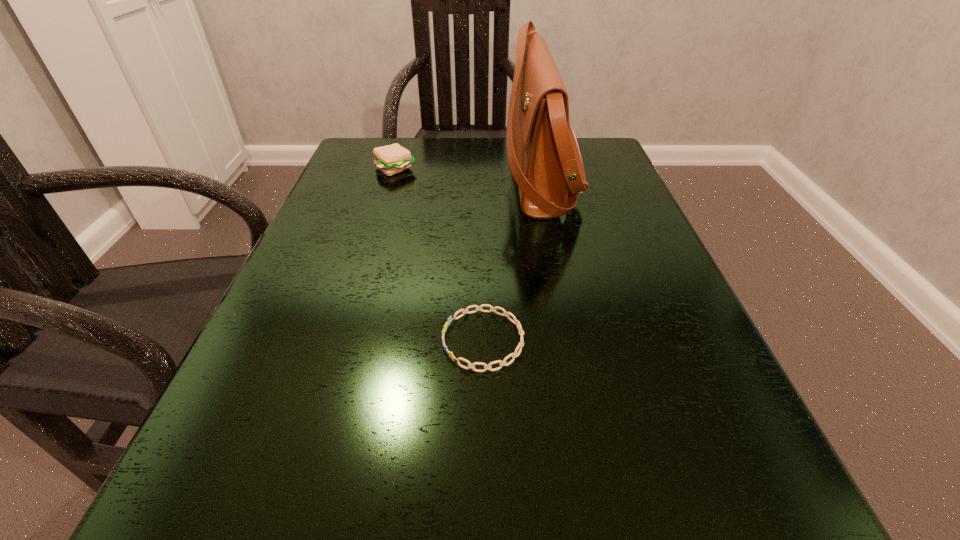
The image size is (960, 540). What are the coordinates of `satchel` in the screenshot? It's located at 544,157.

Identify the location of patty. The width and height of the screenshot is (960, 540). (390, 159).

Find the location of a particular element. Image resolution: width=960 pixels, height=540 pixels. the second tallest object is located at coordinates (390, 159).

Where is `the nearest object`? the nearest object is located at coordinates (502, 363).

Where is `the shortest object`? the shortest object is located at coordinates (502, 363).

The width and height of the screenshot is (960, 540). Find the location of `free region located on the front flap of the tallest object`. free region located on the front flap of the tallest object is located at coordinates (355, 177).

The image size is (960, 540). I want to click on vacant region located on the front flap of the tallest object, so click(399, 177).

Locate an element on the screen. Image resolution: width=960 pixels, height=540 pixels. vacant position located 0.330m on the front flap of the tallest object is located at coordinates (355, 177).

In order to click on vacant space positioned on the front of the patty in this screenshot , I will do `click(383, 207)`.

Identify the location of free space located 0.070m on the surface of the shortest object showing star-shaped elements. The height and width of the screenshot is (540, 960). (394, 340).